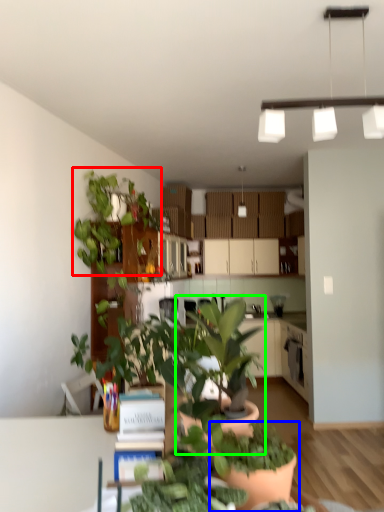
Question: Considering the real-world distances, which object is farthest from houseplant (highlighted by a red box)? houseplant (highlighted by a blue box) or houseplant (highlighted by a green box)?

Choices:
 (A) houseplant
 (B) houseplant

Answer: (A)